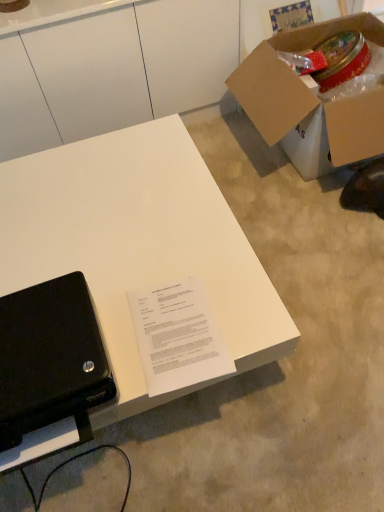
The width and height of the screenshot is (384, 512). I want to click on vacant space situated above white paper at center (from a real-world perspective), so click(179, 328).